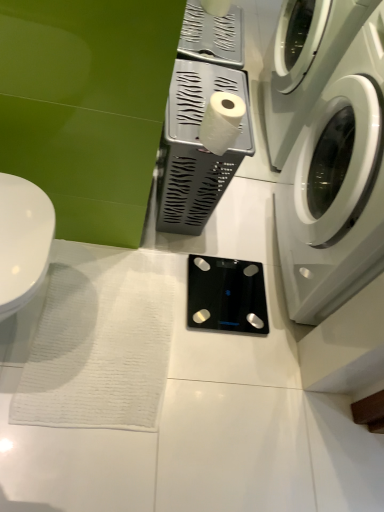
Where is `vacant space positioned to the left of black glass scale at center, acting as the 2th appliance starting from the top`? This screenshot has width=384, height=512. vacant space positioned to the left of black glass scale at center, acting as the 2th appliance starting from the top is located at coordinates (159, 274).